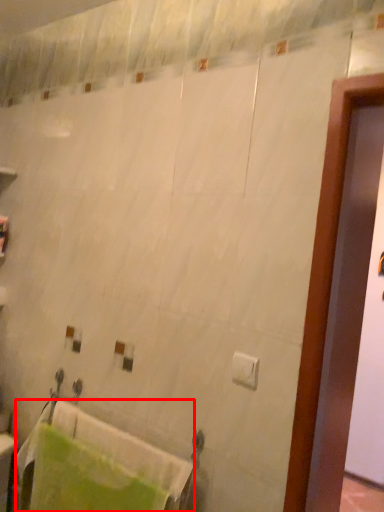
Question: Considering the relative positions of bath towel (annotated by the red box) and toilet paper in the image provided, where is bath towel (annotated by the red box) located with respect to the staircase?

Choices:
 (A) left
 (B) right

Answer: (A)